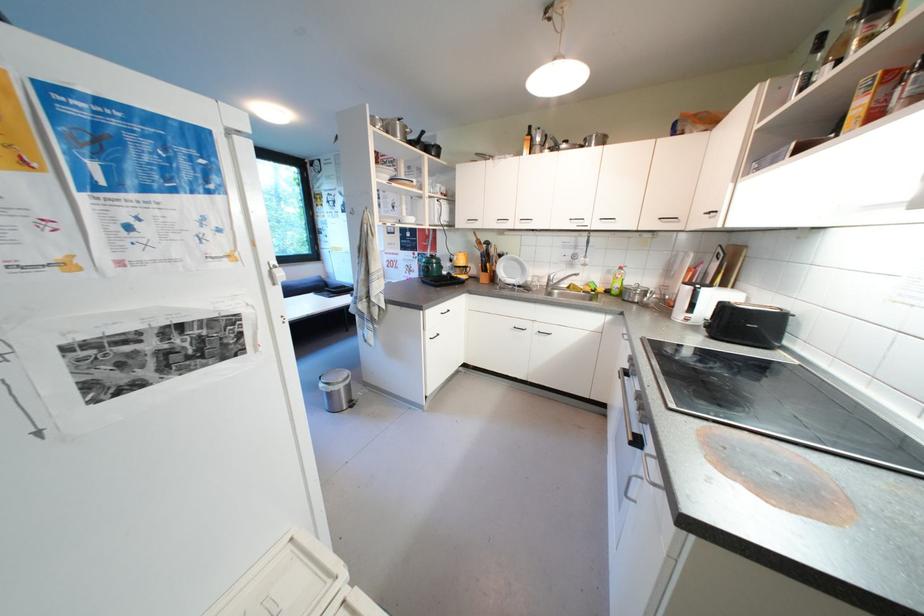
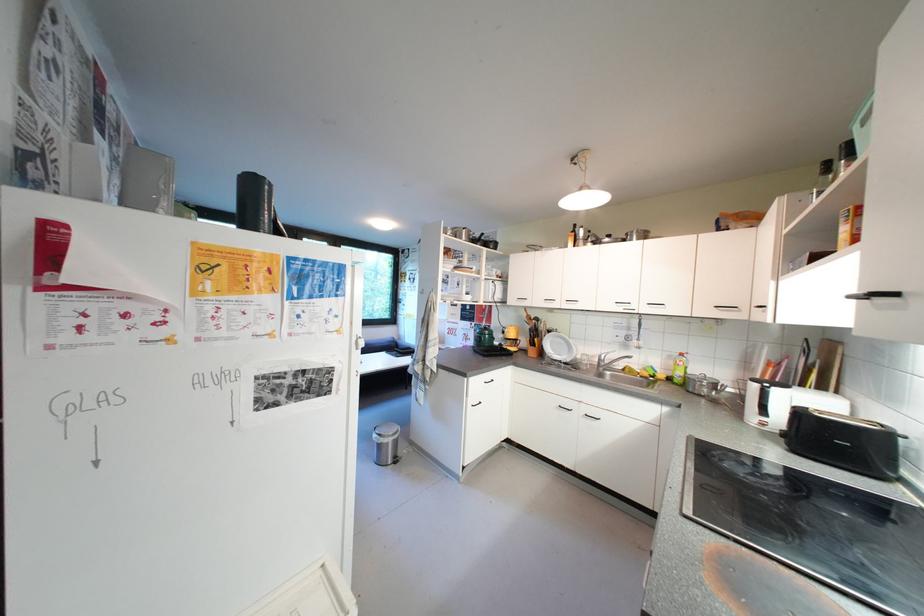
Find the pixel in the second image that matches [330,387] in the first image.

(383, 438)